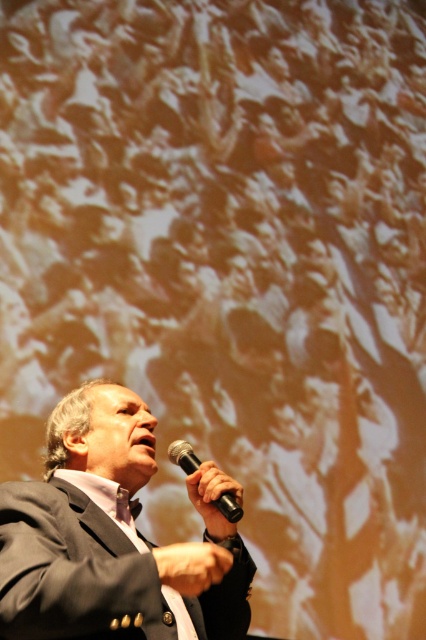
You are a photographer at the event. You need to capture a photo where the dark gray suit at center and the black matte microphone at center are both clearly visible. Based on their positions, which object should you focus on first to ensure both are in focus?

The dark gray suit at center is below the black matte microphone at center, so you should focus on the black matte microphone at center first to ensure both are in focus since it is higher up and closer to the focal plane.

You are a photographer at the event and need to capture a closeup shot of the speaker. Since the dark gray suit at center and the black matte microphone at center are both in the frame, which object will appear wider in your photo?

The dark gray suit at center is wider than the black matte microphone at center, so it will appear wider in the photo.

Based on the photo, you are organizing a stage setup for a speaker and need to ensure the dark gray suit at center and the black matte microphone at center are visible to the audience. Which object should be placed closer to the front to ensure both are visible?

The dark gray suit at center is bigger than the black matte microphone at center, so placing the smaller black matte microphone at center closer to the front will balance their visibility since the larger suit will naturally stand out more from a distance.